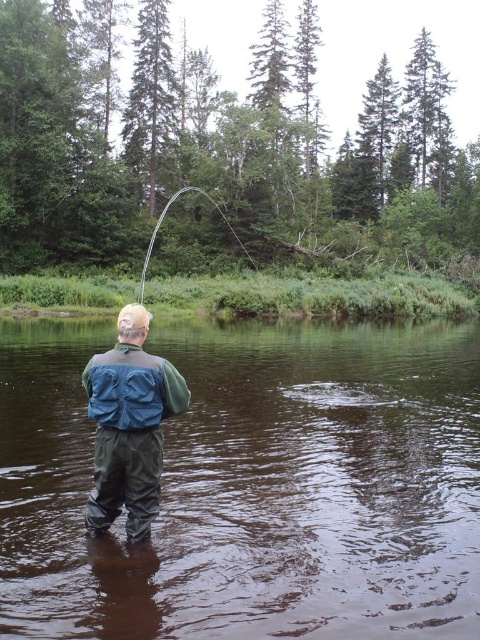
Between green waterproof suit at center and blue waterproof jacket at back, which one has less height?

blue waterproof jacket at back

Is green waterproof suit at center to the right of blue waterproof jacket at back from the viewer's perspective?

Correct, you'll find green waterproof suit at center to the right of blue waterproof jacket at back.

Does point (103, 356) lie behind point (168, 369)?

Yes, point (103, 356) is behind point (168, 369).

At what (x,y) coordinates should I click in order to perform the action: click on green waterproof suit at center. Please return your answer as a coordinate pair (x, y). Looking at the image, I should click on (129, 426).

Which is more to the right, brown rubber boots at lower center or blue waterproof jacket at back?

From the viewer's perspective, brown rubber boots at lower center appears more on the right side.

Is brown rubber boots at lower center further to camera compared to blue waterproof jacket at back?

No, brown rubber boots at lower center is in front of blue waterproof jacket at back.

The width and height of the screenshot is (480, 640). What do you see at coordinates (252, 486) in the screenshot? I see `brown rubber boots at lower center` at bounding box center [252, 486].

Where is `brown rubber boots at lower center`? The width and height of the screenshot is (480, 640). brown rubber boots at lower center is located at coordinates (252, 486).

Who is positioned more to the left, green waterproof suit at center or shiny silver rod at center?

From the viewer's perspective, shiny silver rod at center appears more on the left side.

Does point (117, 429) come farther from viewer compared to point (140, 276)?

No, (117, 429) is closer to viewer.

Who is more distant from viewer, (126, 419) or (153, 237)?

The point (153, 237) is behind.

Where is `green waterproof suit at center`? green waterproof suit at center is located at coordinates (129, 426).